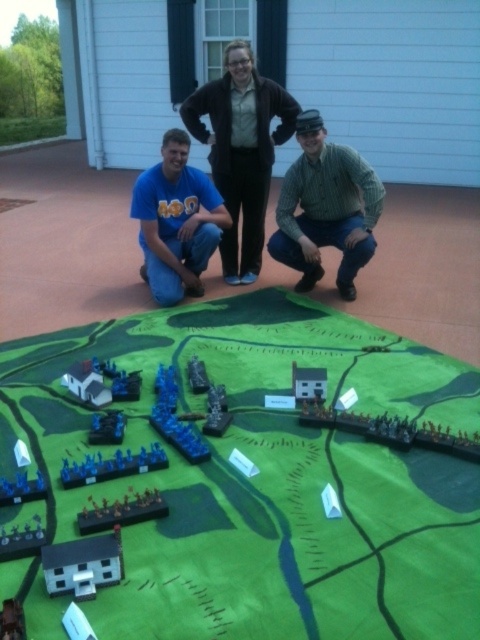
Is point (98, 460) more distant than point (11, 484)?

Yes, point (98, 460) is farther from viewer.

Between blue plastic soldiers at lower center and blue plastic toy soldiers at lower left, which one has more height?

blue plastic soldiers at lower center

Is point (111, 461) in front of point (22, 492)?

That is False.

Find the location of a particular element. The width and height of the screenshot is (480, 640). blue plastic soldiers at lower center is located at coordinates (111, 465).

Who is higher up, matte black house at lower left or brushed metal toy at lower left?

brushed metal toy at lower left is above.

Is matte black house at lower left to the left of brushed metal toy at lower left from the viewer's perspective?

Incorrect, matte black house at lower left is not on the left side of brushed metal toy at lower left.

Between point (52, 593) and point (106, 420), which one is positioned in front?

Point (52, 593) is more forward.

Where is `matte black house at lower left`? The width and height of the screenshot is (480, 640). matte black house at lower left is located at coordinates (83, 564).

Which of these two, matte black jacket at center or blue matte t-shirt at center, stands taller?

matte black jacket at center

Can you confirm if matte black jacket at center is positioned above blue matte t-shirt at center?

Yes.

Locate an element on the screen. The width and height of the screenshot is (480, 640). matte black jacket at center is located at coordinates (240, 148).